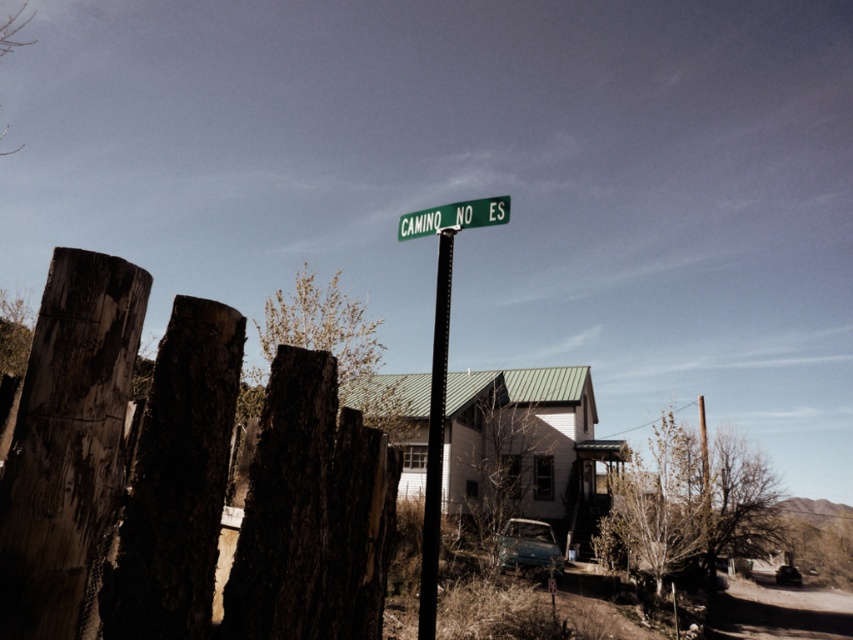
Does point (82, 476) lie behind point (523, 540)?

No, (82, 476) is closer to viewer.

Does weathered wood fence at left have a smaller size compared to teal matte car at center?

Indeed, weathered wood fence at left has a smaller size compared to teal matte car at center.

Which is in front, point (194, 502) or point (529, 548)?

Point (194, 502) is in front.

This screenshot has height=640, width=853. I want to click on weathered wood fence at left, so [x=67, y=432].

Can you confirm if weathered wood fence at left is positioned above black metal pole at center?

Correct, weathered wood fence at left is located above black metal pole at center.

Between weathered wood fence at left and black metal pole at center, which one is positioned lower?

black metal pole at center is lower down.

Is point (314, 557) positioned in front of point (428, 419)?

Yes, point (314, 557) is in front of point (428, 419).

Locate an element on the screen. weathered wood fence at left is located at coordinates (67, 432).

Is point (428, 442) farther from viewer compared to point (779, 572)?

No, it is not.

Is the position of black metal pole at center more distant than that of metallic blue car at lower right?

That is False.

Where is `black metal pole at center`? black metal pole at center is located at coordinates (434, 442).